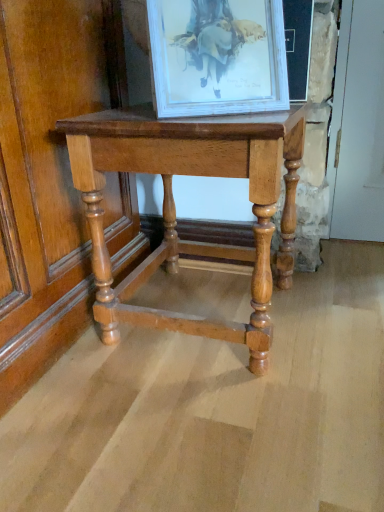
What are the coordinates of `free spot to the right of polished wood table at center` in the screenshot? It's located at (333, 307).